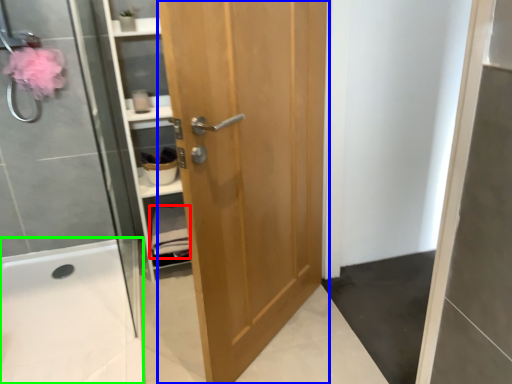
Question: Considering the real-world distances, which object is farthest from material (highlighted by a red box)? door (highlighted by a blue box) or bath (highlighted by a green box)?

Choices:
 (A) door
 (B) bath

Answer: (A)